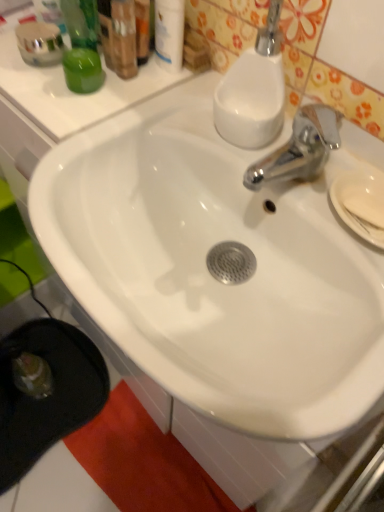
Find the location of a particular element. vacant area that lies to the right of green matte jar at upper left is located at coordinates (169, 105).